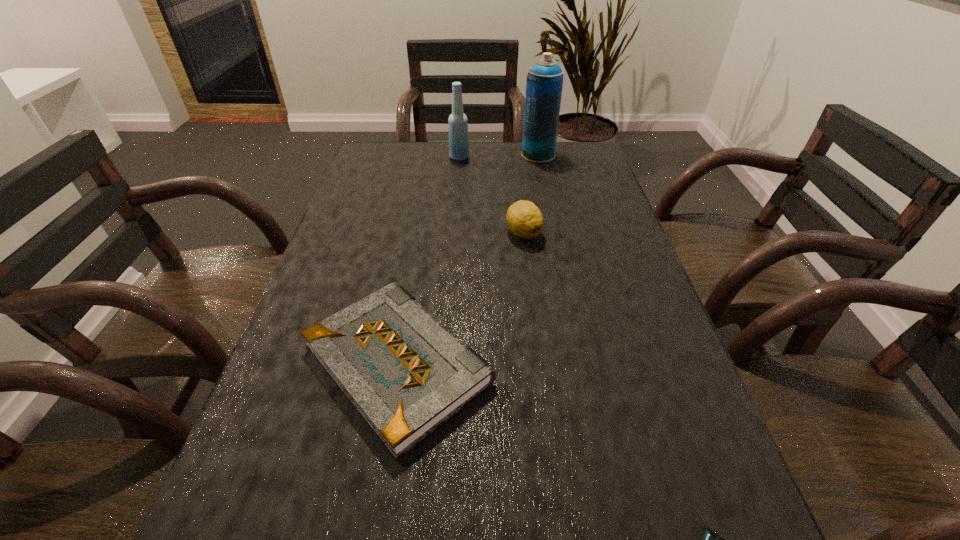
Where is `free space between the bottle and the tallest object`? The width and height of the screenshot is (960, 540). free space between the bottle and the tallest object is located at coordinates (499, 156).

I want to click on free space between the fourth tallest object and the bottle, so click(x=428, y=261).

Locate an element on the screen. The width and height of the screenshot is (960, 540). unoccupied area between the third farthest object and the second tallest object is located at coordinates (492, 195).

Identify the location of vacant point located between the third tallest object and the tallest object. Image resolution: width=960 pixels, height=540 pixels. (531, 194).

Find the location of a particular element. The image size is (960, 540). free space between the second nearest object and the third nearest object is located at coordinates (461, 298).

Locate an element on the screen. The width and height of the screenshot is (960, 540). empty location between the second shortest object and the tallest object is located at coordinates (468, 259).

At what (x,y) coordinates should I click in order to perform the action: click on free space between the third tallest object and the tallest object. Please return your answer as a coordinate pair (x, y). Looking at the image, I should click on (531, 194).

The image size is (960, 540). What are the coordinates of `object that is the second closest to the third shortest object` in the screenshot? It's located at (544, 84).

Choose which object is the second nearest neighbor to the rightmost object. Please provide its 2D coordinates. Your answer should be formatted as a tuple, i.e. [(x, y)], where the tuple contains the x and y coordinates of a point satisfying the conditions above.

[(524, 218)]